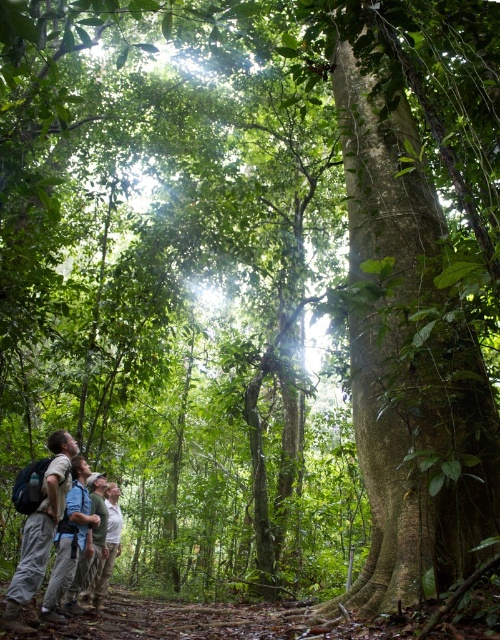
Question: Can you confirm if light brown backpack at lower left is positioned to the right of light gray shirt at lower center?

Choices:
 (A) no
 (B) yes

Answer: (B)

Question: Does light brown backpack at lower left appear on the right side of light gray shirt at lower center?

Choices:
 (A) yes
 (B) no

Answer: (A)

Question: Which point is closer to the camera?

Choices:
 (A) (106, 490)
 (B) (68, 445)

Answer: (B)

Question: In this image, where is light brown backpack at lower left located relative to light gray shirt at lower center?

Choices:
 (A) above
 (B) below

Answer: (A)